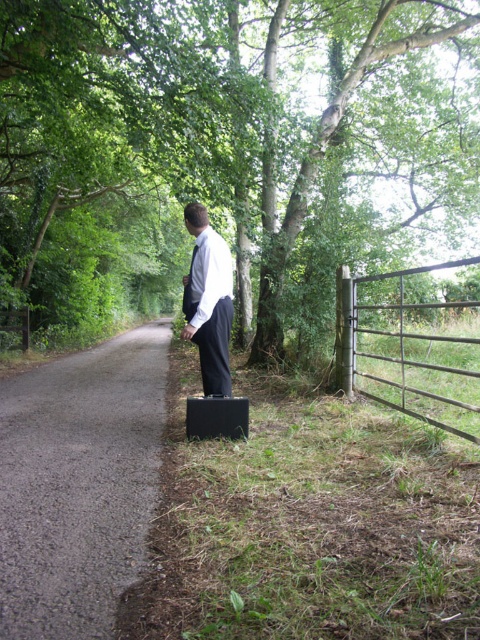
You are a delivery person trying to reach a house located behind the metallic gate at right. You see the white smooth shirt at center belonging to a person standing near the gate. Can you estimate whether the gate is wide enough to allow a delivery cart that is 1.2 meters wide to pass through?

The metallic gate at right is larger in size than the white smooth shirt at center, but without specific width measurements, it is impossible to determine if the gate is wide enough for the delivery cart. Additional information about the gate dimensions is required.

You are a pedestrian trying to cross this rural road. You see two points marked on the road surface. The first point is at coordinate point (88,214) and the second is at point (238,429). If you start walking from the first point towards the second, will you be moving forward along the road or away from it?

The point (88,214) is behind point (238,429), so moving from the first to the second point means you are moving forward along the road.